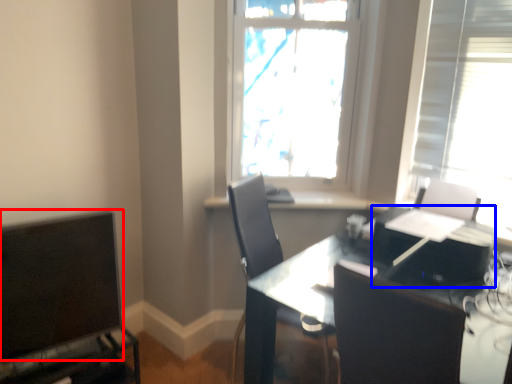
Question: Which point is closer to the camera, computer monitor (highlighted by a red box) or computer (highlighted by a blue box)?

Choices:
 (A) computer monitor
 (B) computer

Answer: (B)